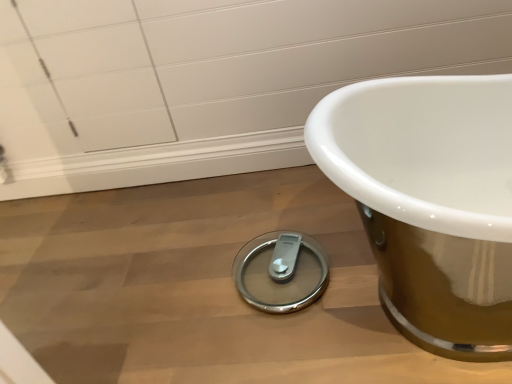
What do you see at coordinates (281, 271) in the screenshot? The width and height of the screenshot is (512, 384). I see `transparent glass lid at center` at bounding box center [281, 271].

This screenshot has height=384, width=512. Find the location of `transparent glass lid at center`. transparent glass lid at center is located at coordinates (281, 271).

Find the location of a particular element. transparent glass lid at center is located at coordinates point(281,271).